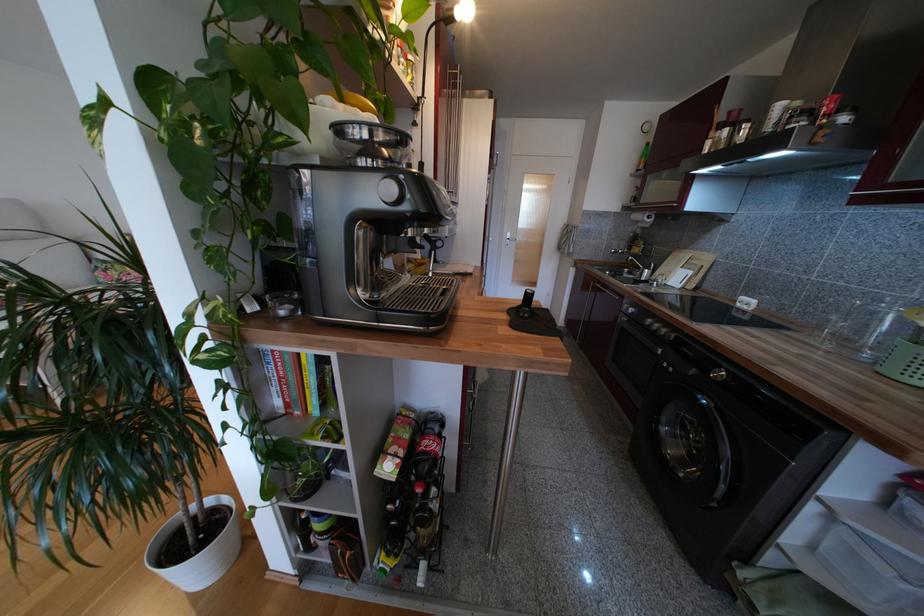
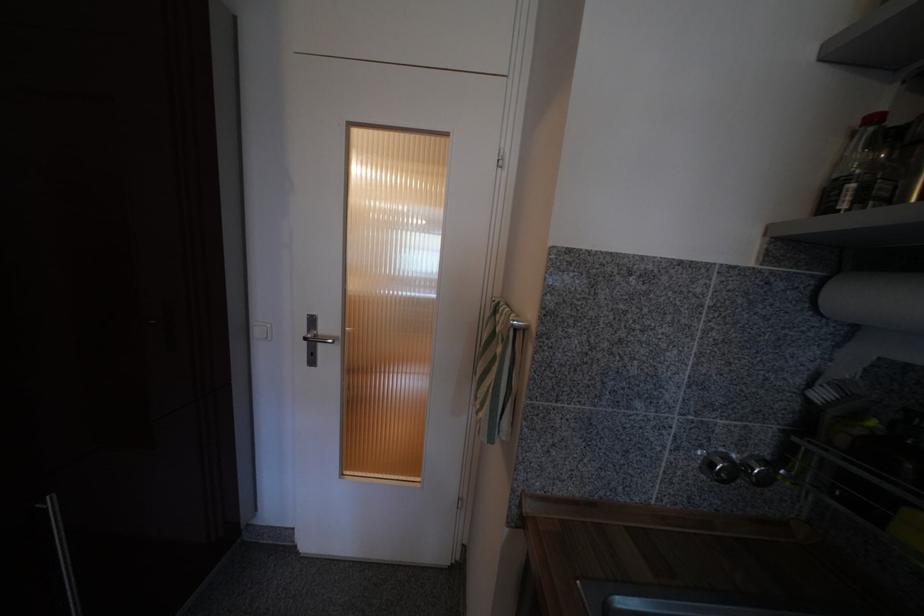
Locate, in the second image, the point that corresponds to pixel 640 188 in the first image.

(879, 121)